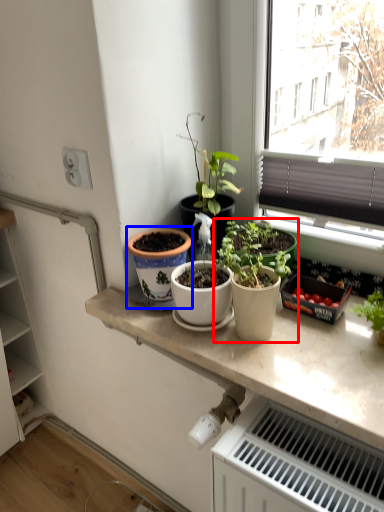
Question: Which object is further to the camera taking this photo, houseplant (highlighted by a red box) or flowerpot (highlighted by a blue box)?

Choices:
 (A) houseplant
 (B) flowerpot

Answer: (B)